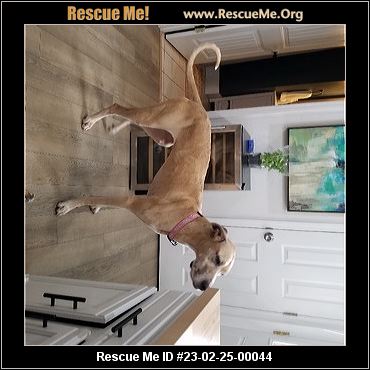
The image size is (370, 370). In order to click on doorknob in this screenshot , I will do `click(268, 236)`.